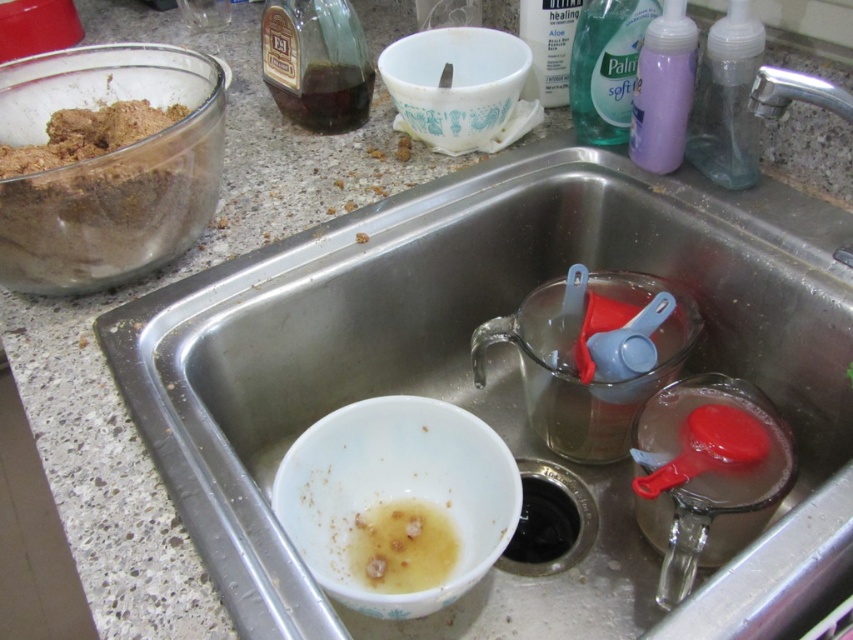
Looking at this image, which is below, translucent glass bowl at upper left or white ceramic bowl at upper center?

translucent glass bowl at upper left is lower down.

This screenshot has height=640, width=853. What do you see at coordinates (109, 168) in the screenshot?
I see `translucent glass bowl at upper left` at bounding box center [109, 168].

You are a GUI agent. You are given a task and a screenshot of the screen. Output one action in this format:
    pyautogui.click(x=<x>, y=<y>)
    Task: Click on the translucent glass bowl at upper left
    
    Given the screenshot: What is the action you would take?
    pyautogui.click(x=109, y=168)

Does translucent glass bowl at upper left lie in front of white glossy bowl at sink bottom?

That is False.

Identify the location of translucent glass bowl at upper left. This screenshot has width=853, height=640. (109, 168).

Between white glossy bowl at lower left and white ceramic bowl at upper center, which one appears on the right side from the viewer's perspective?

white glossy bowl at lower left is more to the right.

Is white glossy bowl at lower left bigger than white ceramic bowl at upper center?

Correct, white glossy bowl at lower left is larger in size than white ceramic bowl at upper center.

Which is in front, point (161, 392) or point (392, 72)?

Point (161, 392) is in front.

Locate an element on the screen. white glossy bowl at lower left is located at coordinates (496, 372).